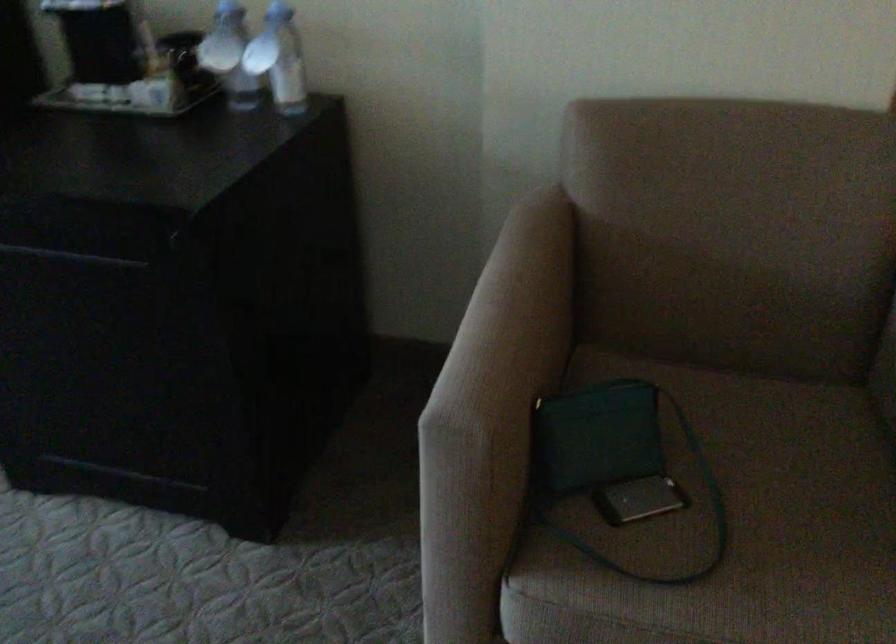
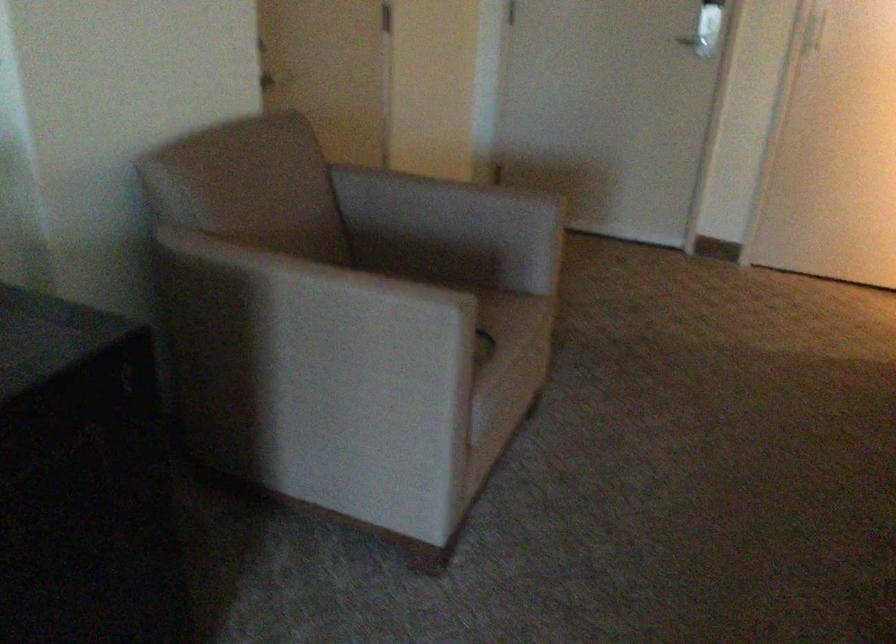
Question: I am providing you with two images of the same scene from different viewpoints. Which of the following objects are not visible in image2?

Choices:
 (A) chair armrest
 (B) metal door handle
 (C) chair sitting surface
 (D) grey storage bin

Answer: (C)